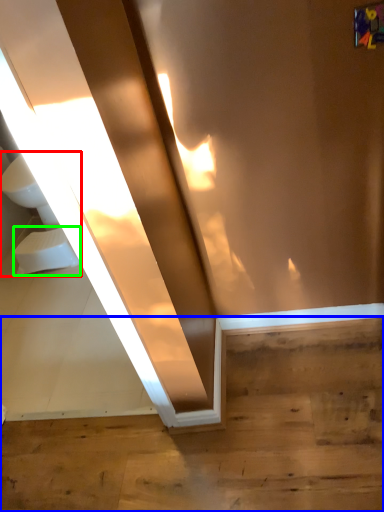
Question: Which object is positioned farthest from sink (highlighted by a red box)? Select from stairwell (highlighted by a blue box) and toilet bowl (highlighted by a green box).

Choices:
 (A) stairwell
 (B) toilet bowl

Answer: (A)